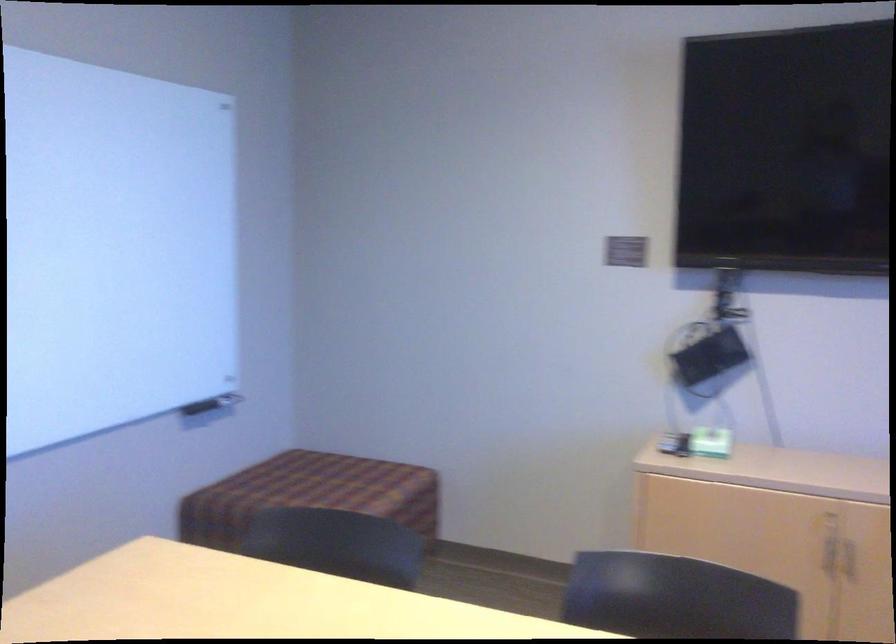
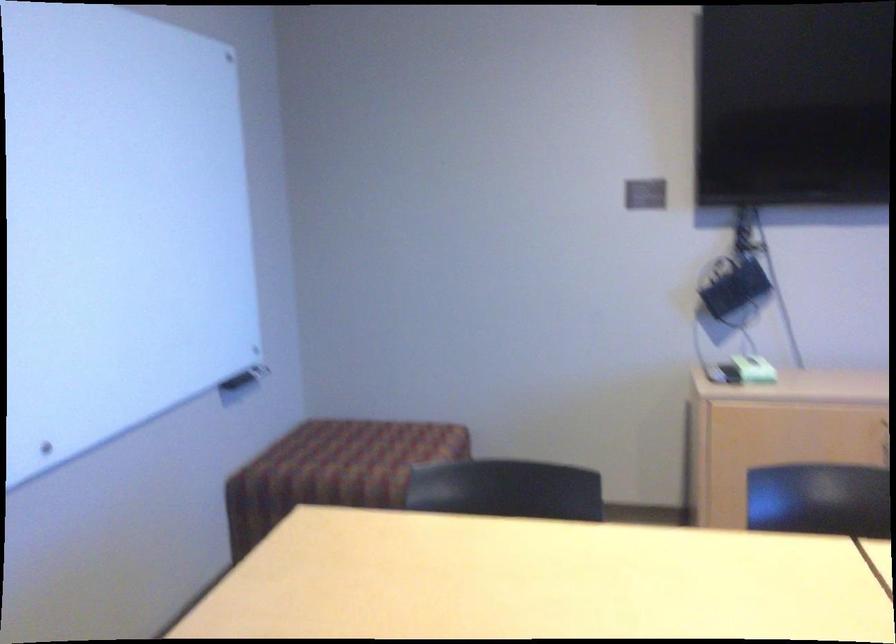
Locate, in the second image, the point that corresponds to point 707,444 in the first image.

(754, 368)